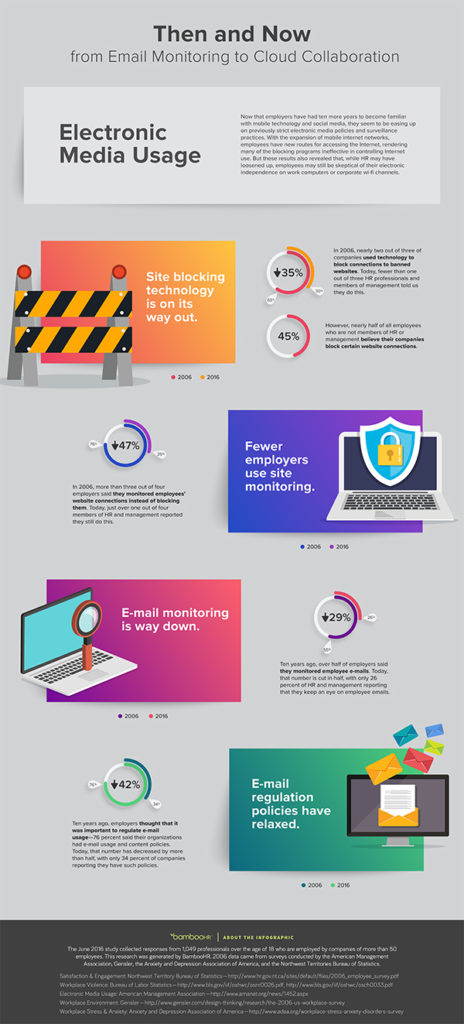
Identify the location of computer monitor. This screenshot has width=464, height=1024. (435, 828).